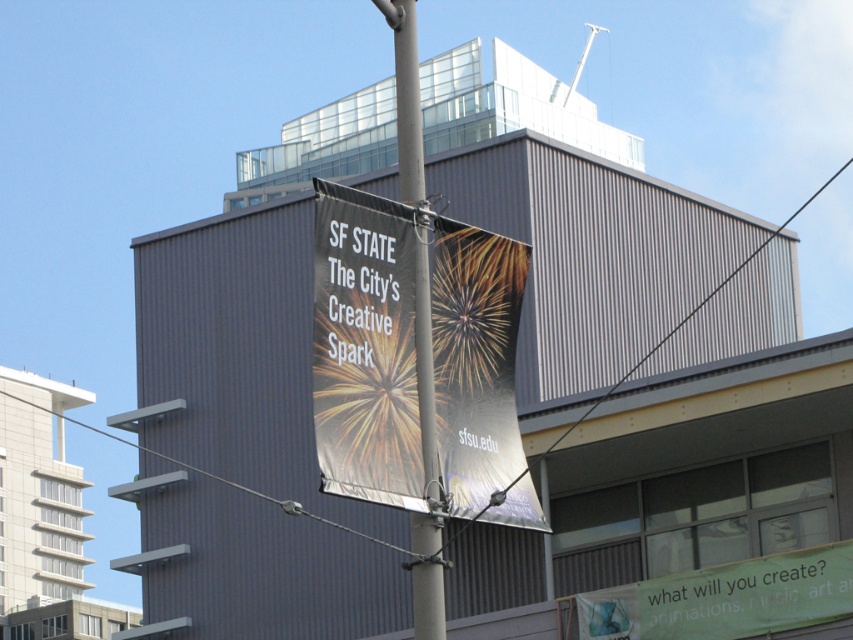
Between metallic banner at center and green fabric banner at lower right, which one appears on the right side from the viewer's perspective?

Positioned to the right is green fabric banner at lower right.

Is metallic banner at center wider than green fabric banner at lower right?

No.

Is point (352, 227) farther from camera compared to point (680, 604)?

That is False.

You are a GUI agent. You are given a task and a screenshot of the screen. Output one action in this format:
    pyautogui.click(x=<x>, y=<y>)
    Task: Click on the metallic banner at center
    This screenshot has width=853, height=640.
    Given the screenshot: What is the action you would take?
    pyautogui.click(x=364, y=348)

Is point (352, 408) farther from camera compared to point (405, 20)?

No, it is in front of (405, 20).

Is metallic banner at center closer to camera compared to metallic pole at center?

Yes, it is in front of metallic pole at center.

Consider the image. Measure the distance between point [460,356] and camera.

Point [460,356] and camera are 37.52 meters apart.

Locate an element on the screen. metallic banner at center is located at coordinates (364, 348).

Between green fabric banner at lower right and metallic pole at center, which one is positioned higher?

metallic pole at center is higher up.

Does point (756, 580) come farther from viewer compared to point (419, 273)?

Yes, point (756, 580) is farther from viewer.

I want to click on green fabric banner at lower right, so click(x=724, y=598).